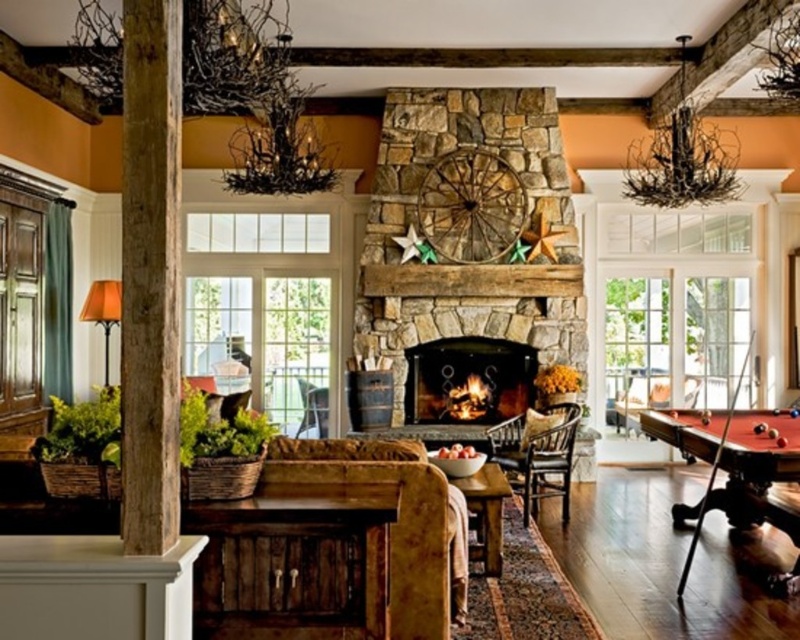
Which of these two, brown rough wood pillar at left or rubberized brown pool table at lower right, stands taller?

Standing taller between the two is brown rough wood pillar at left.

Which is behind, point (128, 372) or point (738, 474)?

Positioned behind is point (738, 474).

Where is `brown rough wood pillar at left`? brown rough wood pillar at left is located at coordinates (150, 275).

Is the position of rustic stone fireplace at center less distant than that of brown leather armchair at center?

That is True.

Which is above, rustic stone fireplace at center or brown leather armchair at center?

Positioned higher is rustic stone fireplace at center.

The image size is (800, 640). Find the location of `rustic stone fireplace at center`. rustic stone fireplace at center is located at coordinates (468, 380).

This screenshot has width=800, height=640. I want to click on rustic stone fireplace at center, so click(468, 380).

Is rubberized brown pool table at lower right taller than dark brown wood armchair at center?

Correct, rubberized brown pool table at lower right is much taller as dark brown wood armchair at center.

Is point (782, 470) positioned behind point (537, 410)?

No, (782, 470) is in front of (537, 410).

This screenshot has height=640, width=800. What are the coordinates of `rubberized brown pool table at lower right` in the screenshot? It's located at (733, 464).